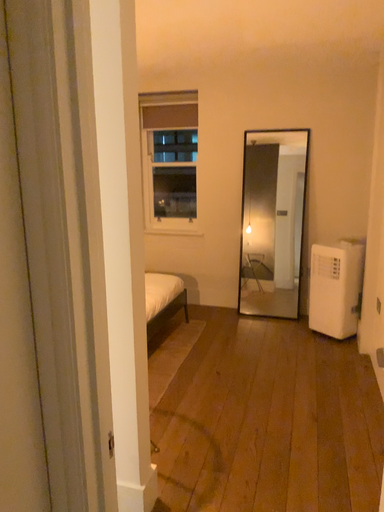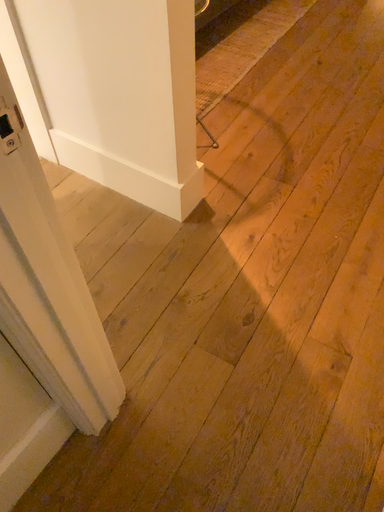
Question: How did the camera likely rotate when shooting the video?

Choices:
 (A) rotated upward
 (B) rotated downward

Answer: (B)